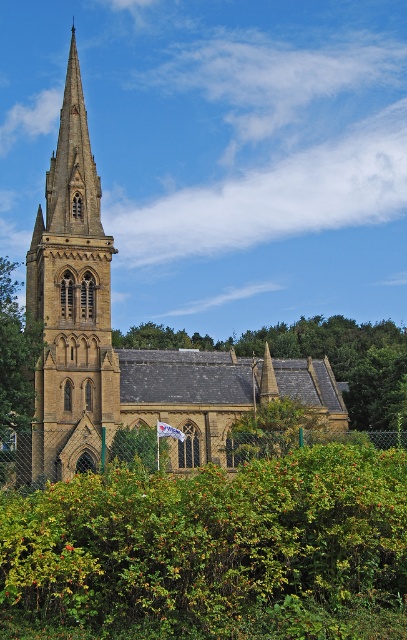
Question: Among these points, which one is nearest to the camera?

Choices:
 (A) (61, 218)
 (B) (382, 417)

Answer: (A)

Question: Does green leafy bush at center have a larger size compared to golden stone church at center?

Choices:
 (A) no
 (B) yes

Answer: (A)

Question: Is the position of green leafy tree at center more distant than that of green leafy tree at left?

Choices:
 (A) no
 (B) yes

Answer: (B)

Question: Which point is closer to the camera taking this photo?

Choices:
 (A) pyautogui.click(x=6, y=268)
 (B) pyautogui.click(x=120, y=552)
 (C) pyautogui.click(x=43, y=384)
 (D) pyautogui.click(x=65, y=291)

Answer: (B)

Question: Is green leafy bush at center positioned behind golden stone church at center?

Choices:
 (A) no
 (B) yes

Answer: (A)

Question: Which point is farther to the camera?

Choices:
 (A) green leafy bush at center
 (B) green leafy tree at center
 (C) golden stone church at center
 (D) brown stone tower at left

Answer: (B)